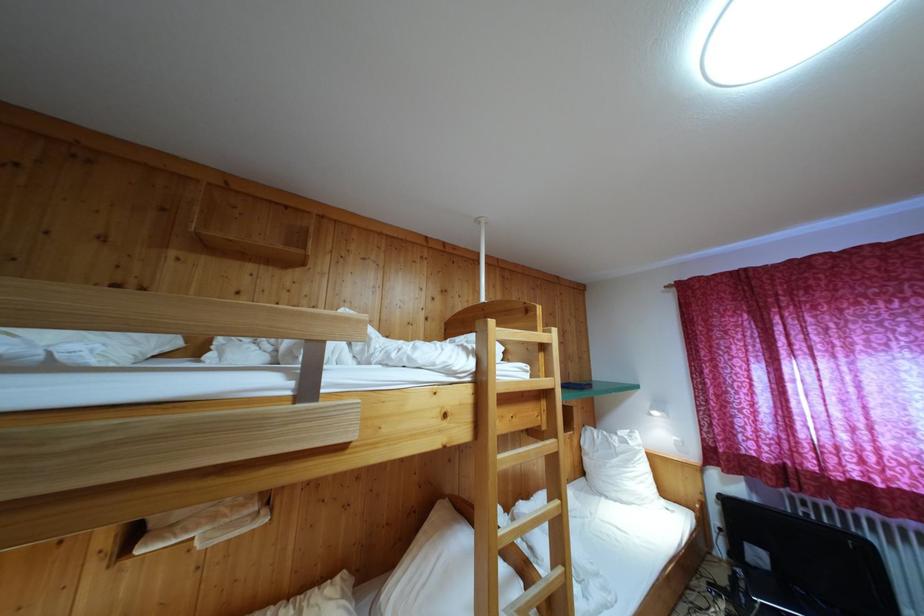
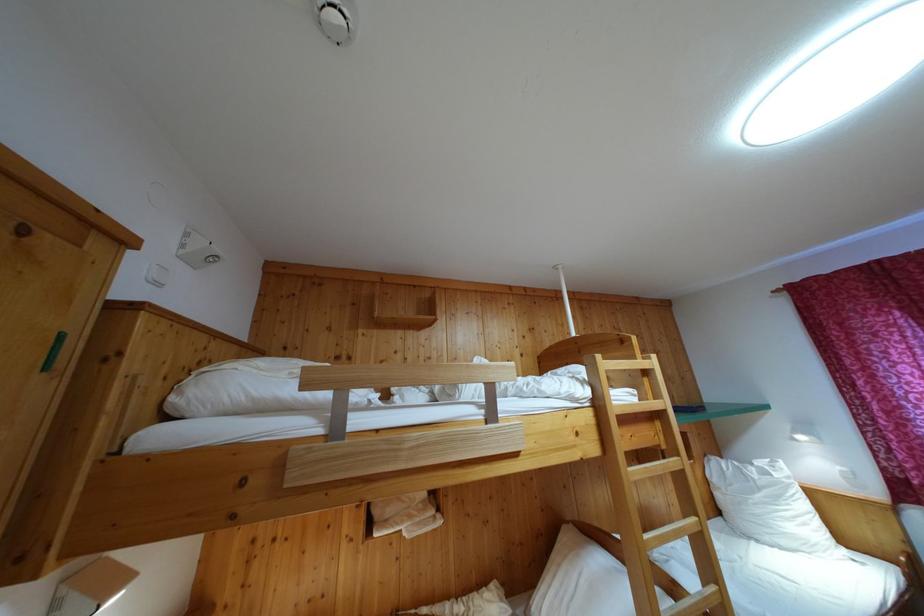
The point at (619, 440) is marked in the first image. Where is the corresponding point in the second image?

(755, 471)